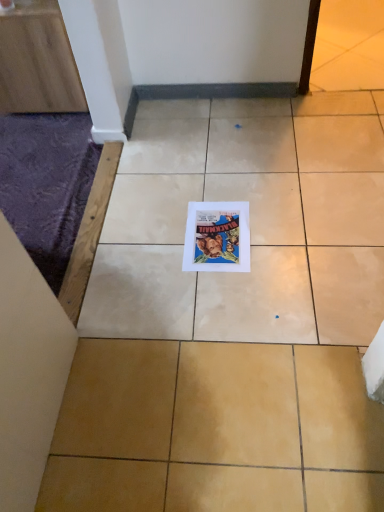
The width and height of the screenshot is (384, 512). Find the location of `vacant area that is in front of matte paper comic book at center`. vacant area that is in front of matte paper comic book at center is located at coordinates (231, 297).